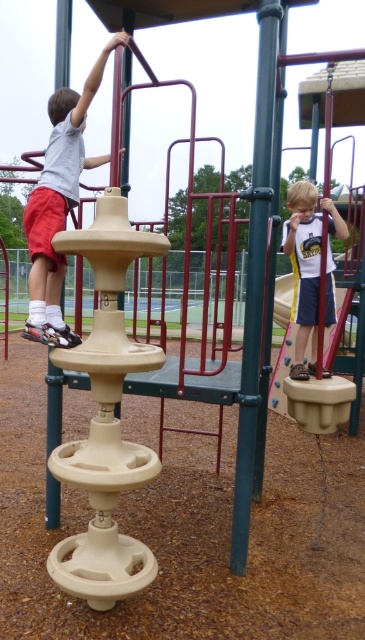
You are standing at the point marked as point (59, 204) on the playground. Looking around, you see the beige climbing structure at left. Which direction should you face to see the beige climbing structure at left?

You should face to the left to see the beige climbing structure at left since you are at point (59, 204) which is on the beige climbing structure at left.

You are a parent supervising children at the playground. You see the matte beige climbing structure at left and the matte white shirt at lower right. Which object is positioned to the left of the other?

The matte beige climbing structure at left is to the left of the matte white shirt at lower right.